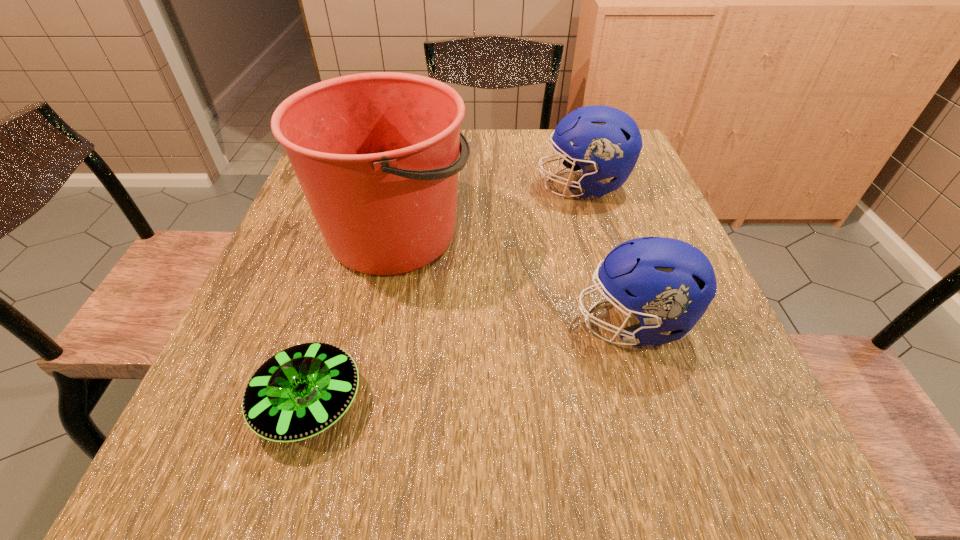
This screenshot has width=960, height=540. I want to click on the tallest object, so click(376, 154).

Where is `the farther football helmet`? This screenshot has width=960, height=540. the farther football helmet is located at coordinates (607, 142).

Locate an element on the screen. the nearer football helmet is located at coordinates (668, 284).

This screenshot has height=540, width=960. Find the location of `saucer`. saucer is located at coordinates (301, 391).

Where is `blank space located on the right of the bucket`? blank space located on the right of the bucket is located at coordinates (641, 233).

The image size is (960, 540). I want to click on vacant space located on the front-facing side of the farther football helmet, so click(x=516, y=186).

This screenshot has width=960, height=540. What are the coordinates of `free location located 0.180m on the front-facing side of the farther football helmet` in the screenshot? It's located at (465, 186).

Where is `vacant space situated on the front-facing side of the farther football helmet`? This screenshot has height=540, width=960. vacant space situated on the front-facing side of the farther football helmet is located at coordinates (505, 186).

Image resolution: width=960 pixels, height=540 pixels. I want to click on free space located on the face guard of the nearer football helmet, so click(x=388, y=322).

At what (x,y) coordinates should I click in order to perform the action: click on free region located on the face guard of the nearer football helmet. Please return your answer as a coordinate pair (x, y). The image size is (960, 540). Looking at the image, I should click on (497, 322).